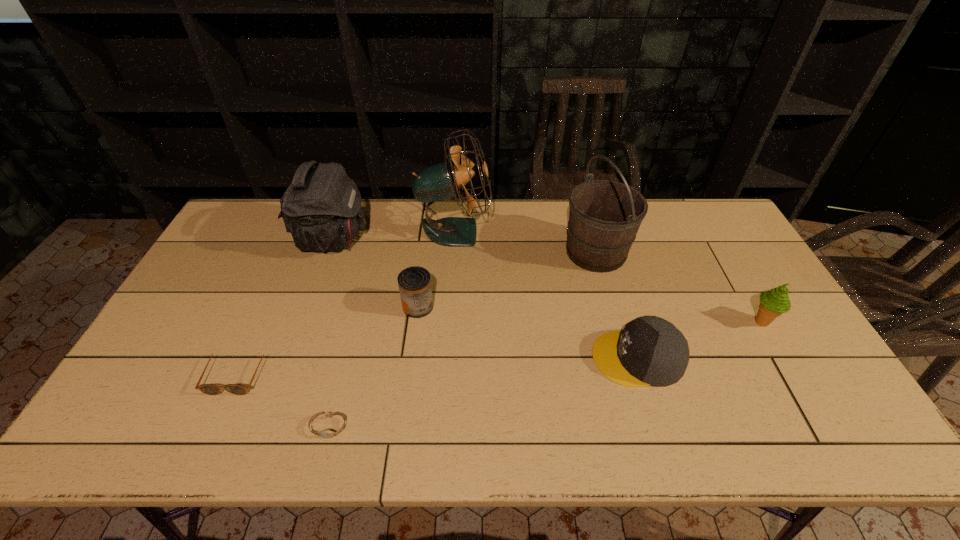
Locate an element on the screen. bucket at the far edge is located at coordinates (604, 218).

Where is `shoulder bag present at the far edge`? shoulder bag present at the far edge is located at coordinates (321, 208).

Identify the location of object at the near edge. The height and width of the screenshot is (540, 960). (327, 434).

Locate an element on the screen. Image resolution: width=960 pixels, height=540 pixels. object that is at the right edge is located at coordinates (x=773, y=303).

The image size is (960, 540). Find the location of `free region at the far edge of the desktop`. free region at the far edge of the desktop is located at coordinates (499, 206).

In the image, there is a desktop. Where is `vacant space at the near edge`? Image resolution: width=960 pixels, height=540 pixels. vacant space at the near edge is located at coordinates (433, 423).

Where is `vacant space at the left edge of the desktop`? This screenshot has width=960, height=540. vacant space at the left edge of the desktop is located at coordinates (202, 316).

This screenshot has height=540, width=960. In the image, there is a desktop. What are the coordinates of `free space at the far left corner` in the screenshot? It's located at (256, 240).

This screenshot has height=540, width=960. Find the location of `vacant space at the far right corner`. vacant space at the far right corner is located at coordinates (714, 217).

Where is `free point between the third tallest object and the shortest object`? This screenshot has height=540, width=960. free point between the third tallest object and the shortest object is located at coordinates (331, 333).